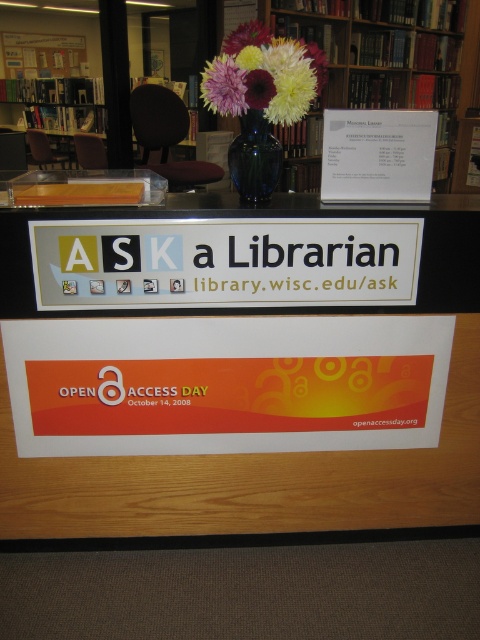
Question: In this image, where is wooden bookshelf at upper center located relative to blue glass vase at center?

Choices:
 (A) above
 (B) below

Answer: (A)

Question: Which object is farther from the camera taking this photo?

Choices:
 (A) pastel floral bouquet at center
 (B) blue glass vase at center
 (C) wooden bookshelf at upper center

Answer: (C)

Question: Among these objects, which one is nearest to the camera?

Choices:
 (A) pastel floral bouquet at center
 (B) wooden bookshelf at upper center
 (C) dark purple flower at center

Answer: (C)

Question: Does white paper at center have a smaller size compared to dark purple flower at center?

Choices:
 (A) yes
 (B) no

Answer: (B)

Question: Among these points, which one is nearest to the camera?

Choices:
 (A) (249, 97)
 (B) (321, 58)
 (C) (229, 374)
 (D) (231, 35)

Answer: (A)

Question: Is wooden bookshelf at upper center positioned in front of blue glass vase at center?

Choices:
 (A) no
 (B) yes

Answer: (A)